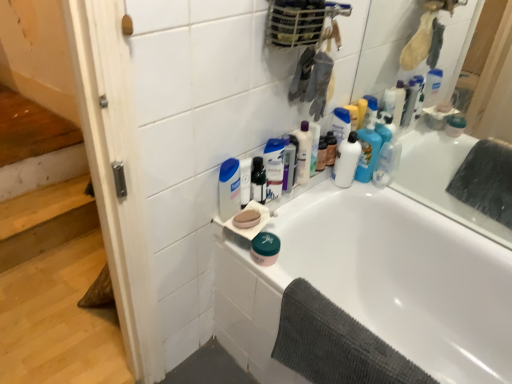
Identify the location of free spot to the left of white wood screen door at left. (47, 309).